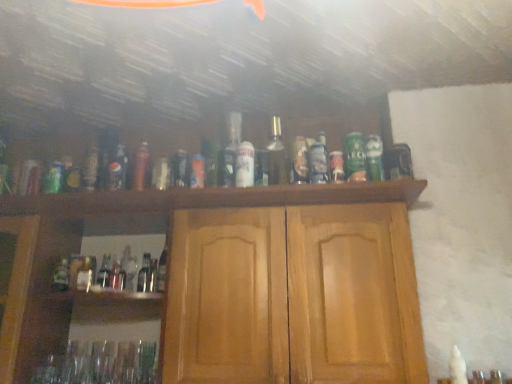
Question: Considering the relative sizes of matte glass bottle at center, the 8th bottle when ordered from left to right, and white matte can at center, acting as the 1th beer starting from the left, in the image provided, is matte glass bottle at center, the 8th bottle when ordered from left to right, smaller than white matte can at center, acting as the 1th beer starting from the left,?

Choices:
 (A) yes
 (B) no

Answer: (B)

Question: Does matte glass bottle at center, marked as the 3th bottle in a right-to-left arrangement, come in front of white matte can at center, acting as the 1th beer starting from the left?

Choices:
 (A) yes
 (B) no

Answer: (B)

Question: From a real-world perspective, is matte glass bottle at center, marked as the 3th bottle in a right-to-left arrangement, on white matte can at center, which ranks as the second beer in right-to-left order?

Choices:
 (A) no
 (B) yes

Answer: (B)

Question: From the image's perspective, is matte glass bottle at center, the 8th bottle when ordered from left to right, located above white matte can at center, acting as the 1th beer starting from the left?

Choices:
 (A) yes
 (B) no

Answer: (A)

Question: Is matte glass bottle at center, the 8th bottle when ordered from left to right, outside white matte can at center, acting as the 1th beer starting from the left?

Choices:
 (A) yes
 (B) no

Answer: (A)

Question: Is point click(59, 281) positioned closer to the camera than point click(240, 129)?

Choices:
 (A) farther
 (B) closer

Answer: (A)

Question: From the image's perspective, relative to matte glass bottle at center, marked as the 3th bottle in a right-to-left arrangement, is green glass bottle at lower left, acting as the 1th bottle starting from the left, above or below?

Choices:
 (A) below
 (B) above

Answer: (A)

Question: Is green glass bottle at lower left, acting as the 1th bottle starting from the left, to the left or to the right of matte glass bottle at center, the 8th bottle when ordered from left to right, in the image?

Choices:
 (A) right
 (B) left

Answer: (B)

Question: Is green glass bottle at lower left, acting as the 1th bottle starting from the left, in front of or behind matte glass bottle at center, marked as the 3th bottle in a right-to-left arrangement, in the image?

Choices:
 (A) behind
 (B) front

Answer: (A)

Question: Considering the positions of matte glass bottle at center, the fifth bottle in the right-to-left sequence, and green matte can at center, the first beer when ordered from right to left, in the image, is matte glass bottle at center, the fifth bottle in the right-to-left sequence, wider or thinner than green matte can at center, the first beer when ordered from right to left,?

Choices:
 (A) wide
 (B) thin

Answer: (A)

Question: From the image's perspective, relative to green matte can at center, the second beer positioned from the left, is matte glass bottle at center, the sixth bottle from the left, above or below?

Choices:
 (A) above
 (B) below

Answer: (B)

Question: Considering their positions, is matte glass bottle at center, the sixth bottle from the left, located in front of or behind green matte can at center, the first beer when ordered from right to left?

Choices:
 (A) front
 (B) behind

Answer: (B)

Question: From a real-world perspective, relative to green matte can at center, the first beer when ordered from right to left, is matte glass bottle at center, the sixth bottle from the left, vertically above or below?

Choices:
 (A) above
 (B) below

Answer: (B)

Question: From a real-world perspective, relative to green matte can at center, the first beer when ordered from right to left, is matte glass bottle at center, marked as the 3th bottle in a right-to-left arrangement, vertically above or below?

Choices:
 (A) below
 (B) above

Answer: (B)

Question: Would you say matte glass bottle at center, marked as the 3th bottle in a right-to-left arrangement, is inside or outside green matte can at center, the second beer positioned from the left?

Choices:
 (A) inside
 (B) outside

Answer: (B)